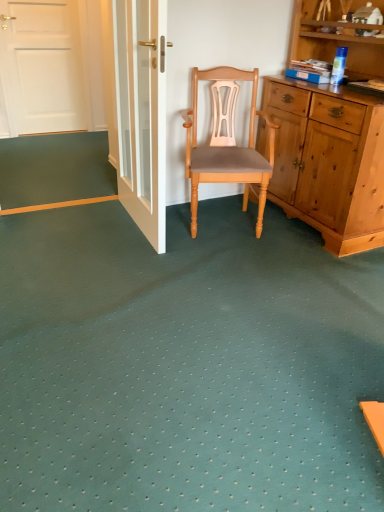
Question: Is light brown wood chair at center completely or partially outside of white glossy door at upper center?

Choices:
 (A) no
 (B) yes

Answer: (B)

Question: Is white glossy door at upper center inside light brown wood chair at center?

Choices:
 (A) no
 (B) yes

Answer: (A)

Question: Is light brown wood chair at center next to white glossy door at upper center and touching it?

Choices:
 (A) yes
 (B) no

Answer: (B)

Question: From a real-world perspective, is light brown wood chair at center positioned under white glossy door at upper center based on gravity?

Choices:
 (A) no
 (B) yes

Answer: (B)

Question: Is light brown wood chair at center positioned behind white glossy door at upper center?

Choices:
 (A) yes
 (B) no

Answer: (A)

Question: Considering the positions of point (152, 71) and point (84, 199), is point (152, 71) closer or farther from the camera than point (84, 199)?

Choices:
 (A) farther
 (B) closer

Answer: (B)

Question: In the image, is white glossy door at upper center positioned in front of or behind orange matte strip at lower left?

Choices:
 (A) front
 (B) behind

Answer: (A)

Question: In terms of width, does white glossy door at upper center look wider or thinner when compared to orange matte strip at lower left?

Choices:
 (A) wide
 (B) thin

Answer: (B)

Question: Considering the positions of white glossy door at upper center and orange matte strip at lower left in the image, is white glossy door at upper center bigger or smaller than orange matte strip at lower left?

Choices:
 (A) big
 (B) small

Answer: (A)

Question: Would you say white glossy door at upper center is inside or outside light brown wood chair at center?

Choices:
 (A) outside
 (B) inside

Answer: (A)

Question: Considering the positions of point (127, 201) and point (185, 122), is point (127, 201) closer or farther from the camera than point (185, 122)?

Choices:
 (A) closer
 (B) farther

Answer: (A)

Question: Considering the positions of white glossy door at upper center and light brown wood chair at center in the image, is white glossy door at upper center bigger or smaller than light brown wood chair at center?

Choices:
 (A) big
 (B) small

Answer: (B)

Question: Visually, is white glossy door at upper center positioned to the left or to the right of light brown wood chair at center?

Choices:
 (A) right
 (B) left

Answer: (B)

Question: Considering their positions, is light brown wood chair at center located in front of or behind white glossy door at upper center?

Choices:
 (A) front
 (B) behind

Answer: (B)

Question: From the image's perspective, is light brown wood chair at center above or below white glossy door at upper center?

Choices:
 (A) below
 (B) above

Answer: (A)